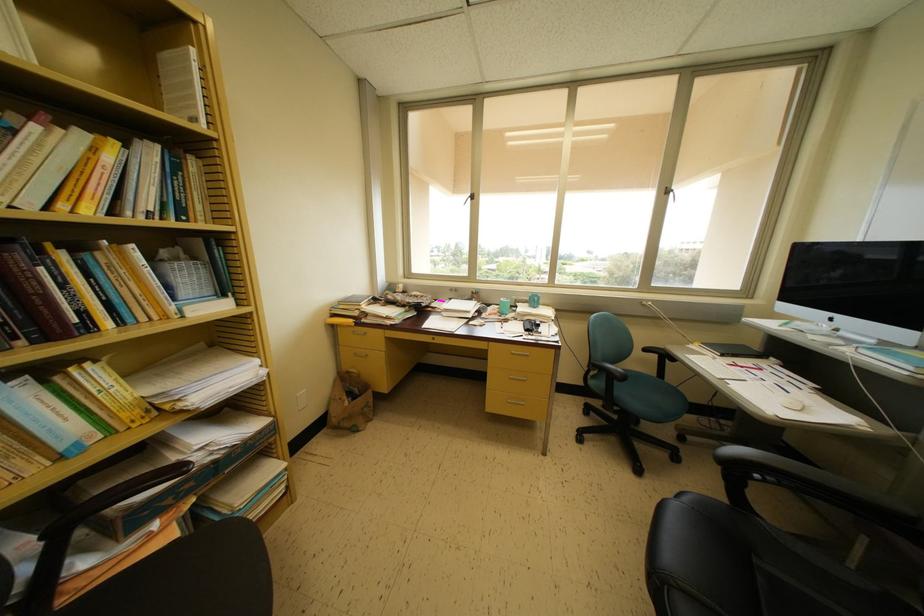
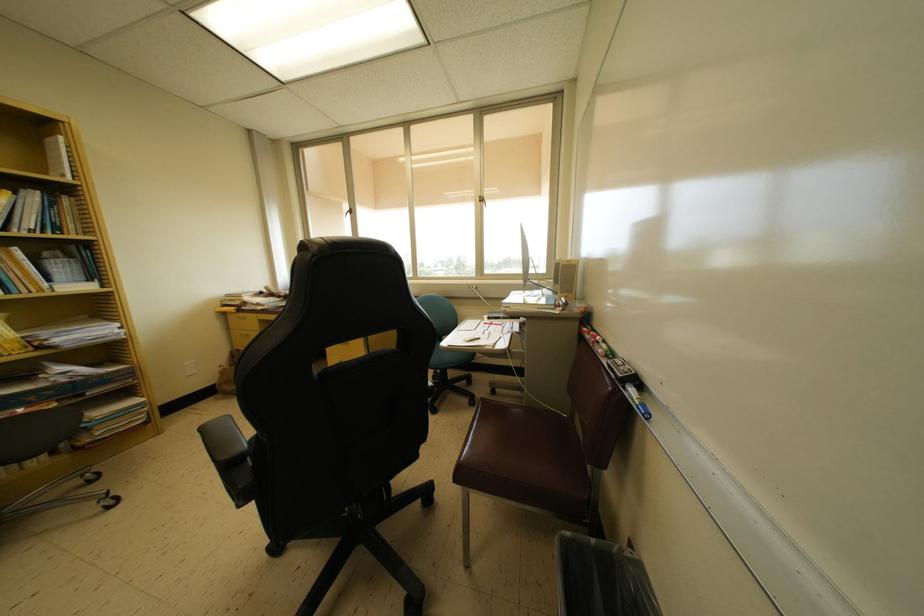
Locate, in the second image, the point that corresponds to point 128,294 in the first image.

(15, 278)